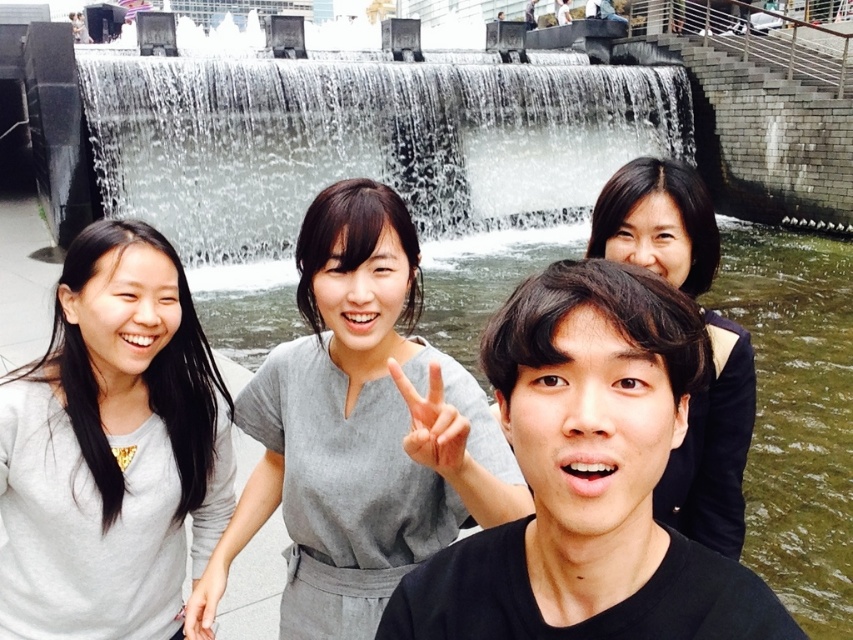
Question: Among these objects, which one is nearest to the camera?

Choices:
 (A) gray matte dress at center
 (B) gray matte sweater at left
 (C) dark brown hair at upper right
 (D) clear water at center

Answer: (C)

Question: Is clear water at center behind gray matte sweater at left?

Choices:
 (A) yes
 (B) no

Answer: (A)

Question: Is black matte shirt at center to the right of dark brown hair at upper right from the viewer's perspective?

Choices:
 (A) no
 (B) yes

Answer: (A)

Question: Which of the following is the closest to the observer?

Choices:
 (A) gray matte dress at center
 (B) black matte shirt at center

Answer: (B)

Question: Is the position of gray matte sweater at left less distant than that of dark brown hair at upper right?

Choices:
 (A) yes
 (B) no

Answer: (B)

Question: Among these objects, which one is farthest from the camera?

Choices:
 (A) dark brown hair at upper right
 (B) gray matte dress at center
 (C) black matte shirt at center
 (D) gray matte sweater at left

Answer: (D)